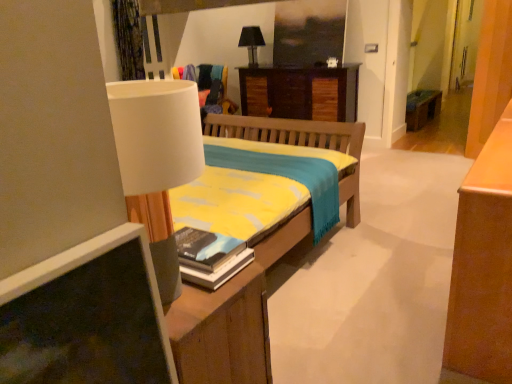
Question: Does black fabric lampshade at upper center have a smaller size compared to wooden bench at right?

Choices:
 (A) no
 (B) yes

Answer: (B)

Question: Can you confirm if black fabric lampshade at upper center is positioned to the right of wooden bench at right?

Choices:
 (A) no
 (B) yes

Answer: (A)

Question: Does black fabric lampshade at upper center have a greater height compared to wooden bench at right?

Choices:
 (A) no
 (B) yes

Answer: (B)

Question: Is black fabric lampshade at upper center positioned with its back to wooden bench at right?

Choices:
 (A) no
 (B) yes

Answer: (A)

Question: Can you confirm if black fabric lampshade at upper center is shorter than wooden bench at right?

Choices:
 (A) no
 (B) yes

Answer: (A)

Question: From the image's perspective, is black fabric lampshade at upper center above wooden bench at right?

Choices:
 (A) no
 (B) yes

Answer: (B)

Question: Is black fabric lampshade at upper center surrounded by wooden desk at center?

Choices:
 (A) yes
 (B) no

Answer: (B)

Question: Does wooden desk at center turn towards black fabric lampshade at upper center?

Choices:
 (A) no
 (B) yes

Answer: (A)

Question: Is wooden desk at center to the left of black fabric lampshade at upper center from the viewer's perspective?

Choices:
 (A) yes
 (B) no

Answer: (B)

Question: From the image's perspective, is wooden desk at center on black fabric lampshade at upper center?

Choices:
 (A) no
 (B) yes

Answer: (A)

Question: Can you confirm if wooden desk at center is bigger than black fabric lampshade at upper center?

Choices:
 (A) no
 (B) yes

Answer: (B)

Question: Does wooden desk at center lie behind black fabric lampshade at upper center?

Choices:
 (A) yes
 (B) no

Answer: (B)

Question: Considering the relative sizes of wooden desk at center and hardcover book at center in the image provided, is wooden desk at center smaller than hardcover book at center?

Choices:
 (A) no
 (B) yes

Answer: (A)